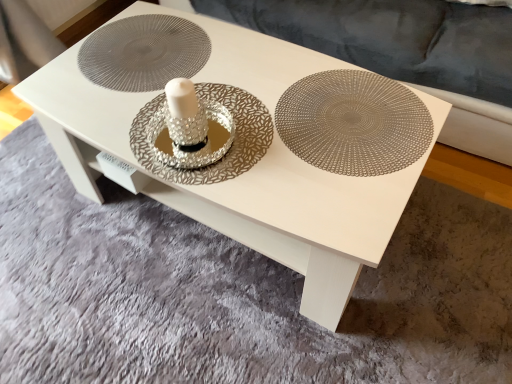
Where is `free point above metallic silver doily at center (from a real-world perspective)`? The height and width of the screenshot is (384, 512). free point above metallic silver doily at center (from a real-world perspective) is located at coordinates (146, 50).